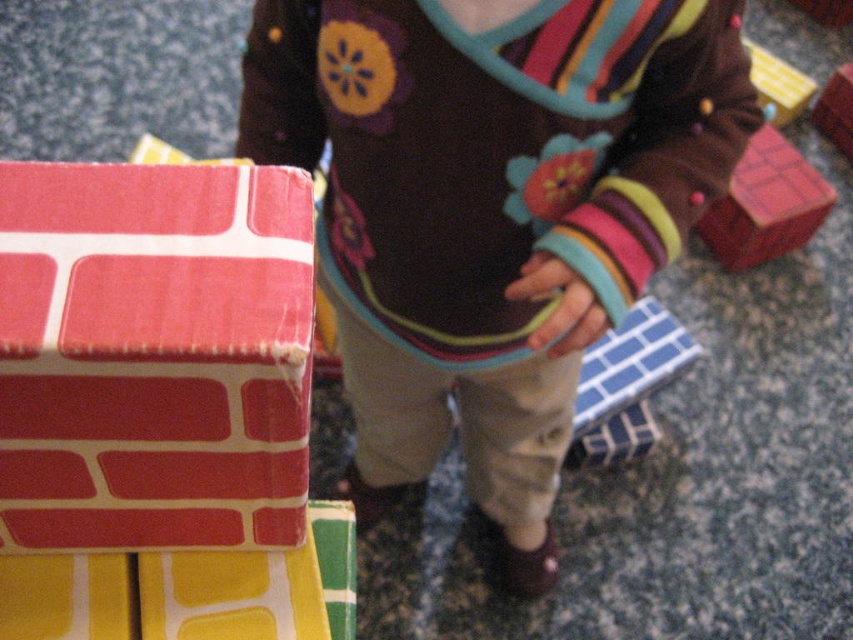
Does floral sweater at center have a greater height compared to brick-patterned cardboard at left?

Yes, floral sweater at center is taller than brick-patterned cardboard at left.

Can you confirm if floral sweater at center is wider than brick-patterned cardboard at left?

Yes.

Does point (682, 58) come behind point (132, 323)?

Yes.

Image resolution: width=853 pixels, height=640 pixels. Find the location of `floral sweater at center`. floral sweater at center is located at coordinates (491, 211).

Based on the photo, can you confirm if floral sweater at center is wider than wooden house at upper right?

Indeed, floral sweater at center has a greater width compared to wooden house at upper right.

Can you confirm if floral sweater at center is smaller than wooden house at upper right?

No, floral sweater at center is not smaller than wooden house at upper right.

You are a GUI agent. You are given a task and a screenshot of the screen. Output one action in this format:
    pyautogui.click(x=<x>, y=<y>)
    Task: Click on the floral sweater at center
    This screenshot has width=853, height=640.
    Given the screenshot: What is the action you would take?
    tap(491, 211)

Locate an element on the screen. This screenshot has height=640, width=853. floral sweater at center is located at coordinates (491, 211).

Who is taller, brick-patterned cardboard at left or matte red brick at right?

matte red brick at right

Based on the photo, who is more distant from viewer, (59,403) or (793,170)?

The point (793,170) is behind.

Who is more forward, (297,451) or (729,250)?

Point (297,451) is in front.

This screenshot has width=853, height=640. I want to click on brick-patterned cardboard at left, so click(x=154, y=355).